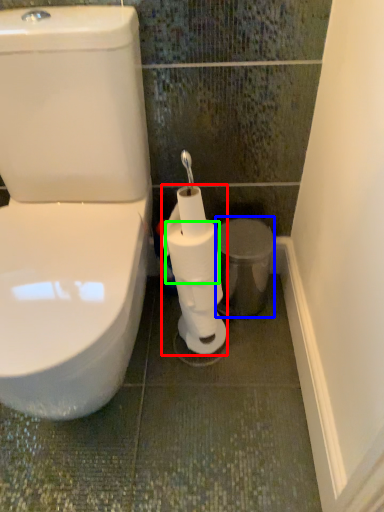
Question: Considering the real-world distances, which object is closest to toilet paper (highlighted by a red box)? porcelain (highlighted by a blue box) or toilet paper (highlighted by a green box).

Choices:
 (A) porcelain
 (B) toilet paper

Answer: (B)